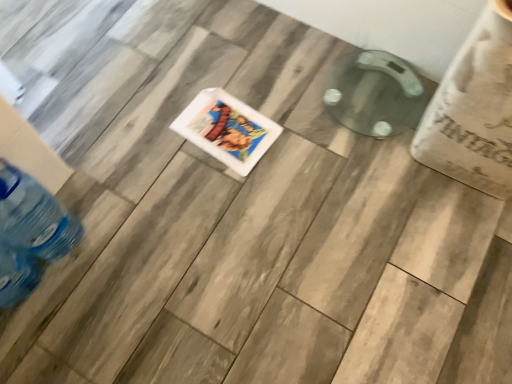
The width and height of the screenshot is (512, 384). Find the location of `vacant area that lies to the right of white glossy comic book at center`. vacant area that lies to the right of white glossy comic book at center is located at coordinates (298, 137).